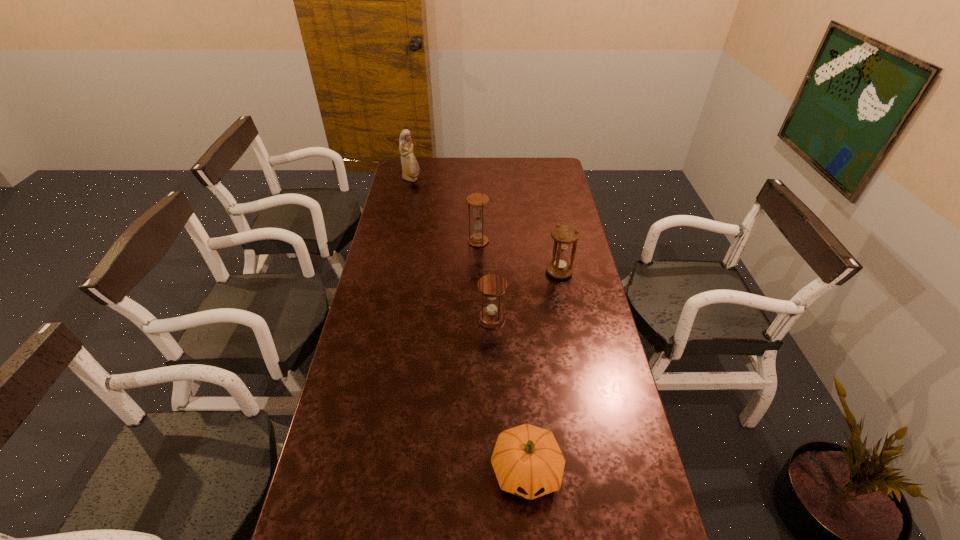
The width and height of the screenshot is (960, 540). Identify the location of the fourth closest object to the rightmost object. (410, 169).

The height and width of the screenshot is (540, 960). In order to click on hourglass that is the nearest to the farthest object in this screenshot , I will do `click(477, 200)`.

Select which hourglass is the closest to the nearest hourglass. Please provide its 2D coordinates. Your answer should be formatted as a tuple, i.e. [(x, y)], where the tuple contains the x and y coordinates of a point satisfying the conditions above.

[(564, 235)]

The height and width of the screenshot is (540, 960). Find the location of `vacant space that satisfies the following two spatial constraints: 1. on the front-facing side of the farthest object; 2. on the right side of the shortest hourglass`. vacant space that satisfies the following two spatial constraints: 1. on the front-facing side of the farthest object; 2. on the right side of the shortest hourglass is located at coordinates (381, 319).

You are a GUI agent. You are given a task and a screenshot of the screen. Output one action in this format:
    pyautogui.click(x=<x>, y=<y>)
    Task: Click on the vacant space that satisfies the following two spatial constraints: 1. on the front-facing side of the leftmost object; 2. on the right side of the second nearest hourglass
    
    Given the screenshot: What is the action you would take?
    pyautogui.click(x=392, y=272)

Where is `vacant space that satisfies the following two spatial constraints: 1. on the front-facing side of the second nearest object; 2. on the right side of the figurine`? This screenshot has height=540, width=960. vacant space that satisfies the following two spatial constraints: 1. on the front-facing side of the second nearest object; 2. on the right side of the figurine is located at coordinates (381, 319).

Locate an element on the screen. blank space that satisfies the following two spatial constraints: 1. on the front-facing side of the tallest object; 2. on the back side of the rightmost hourglass is located at coordinates (392, 272).

Where is `free space in the image that satisfies the following two spatial constraints: 1. on the front-facing side of the farthest hourglass; 2. on the right side of the leftmost object`? free space in the image that satisfies the following two spatial constraints: 1. on the front-facing side of the farthest hourglass; 2. on the right side of the leftmost object is located at coordinates point(398,241).